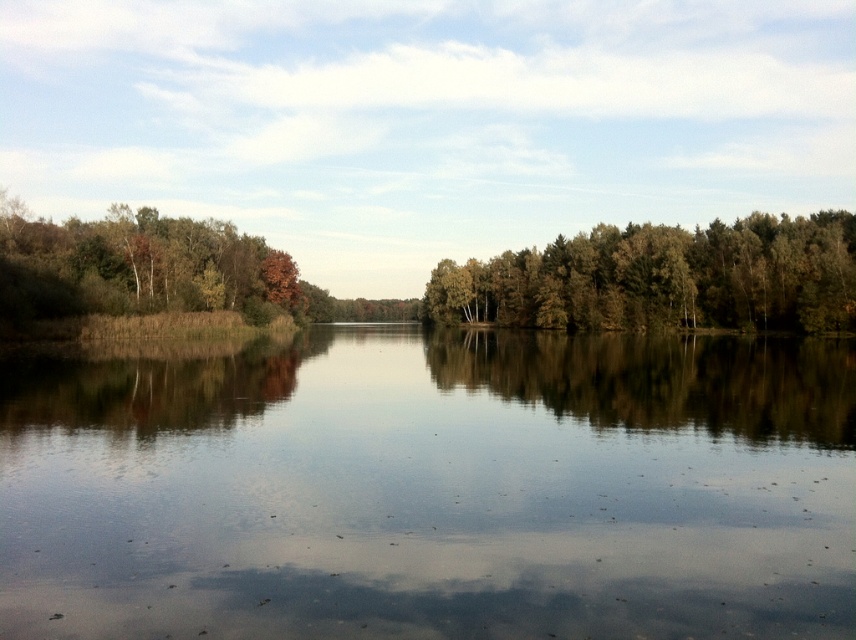
Question: Which of the following is the closest to the observer?

Choices:
 (A) brown matte tree at left
 (B) smooth water at center
 (C) green leafy trees at center

Answer: (B)

Question: Which object is farther from the camera taking this photo?

Choices:
 (A) green leafy trees at center
 (B) smooth water at center
 (C) brown matte tree at left

Answer: (A)

Question: Is smooth water at center wider than green leafy forest at center?

Choices:
 (A) no
 (B) yes

Answer: (A)

Question: In this image, where is green leafy forest at center located relative to brown matte tree at left?

Choices:
 (A) below
 (B) above

Answer: (A)

Question: Estimate the real-world distances between objects in this image. Which object is farther from the smooth water at center?

Choices:
 (A) green leafy forest at center
 (B) green leafy trees at center

Answer: (B)

Question: Can you confirm if green leafy forest at center is wider than green leafy trees at center?

Choices:
 (A) yes
 (B) no

Answer: (A)